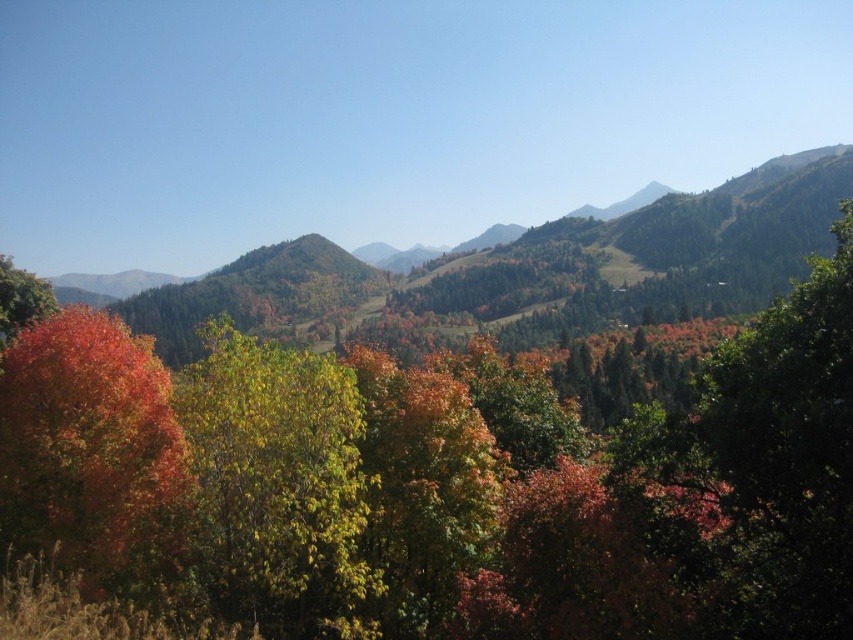
Question: Is shiny red leaves at left below matte orange tree at left?

Choices:
 (A) no
 (B) yes

Answer: (B)

Question: Which of these objects is positioned farthest from the green leafy tree at center?

Choices:
 (A) matte orange tree at left
 (B) shiny red leaves at left

Answer: (A)

Question: Does green leafy tree at center appear over matte orange tree at left?

Choices:
 (A) no
 (B) yes

Answer: (A)

Question: Which of the following is the closest to the observer?

Choices:
 (A) shiny red leaves at left
 (B) green leafy tree at center

Answer: (B)

Question: Which of the following is the farthest from the observer?

Choices:
 (A) green leafy tree at center
 (B) shiny red leaves at left

Answer: (B)

Question: Is green leafy tree at center further to camera compared to shiny red leaves at left?

Choices:
 (A) yes
 (B) no

Answer: (B)